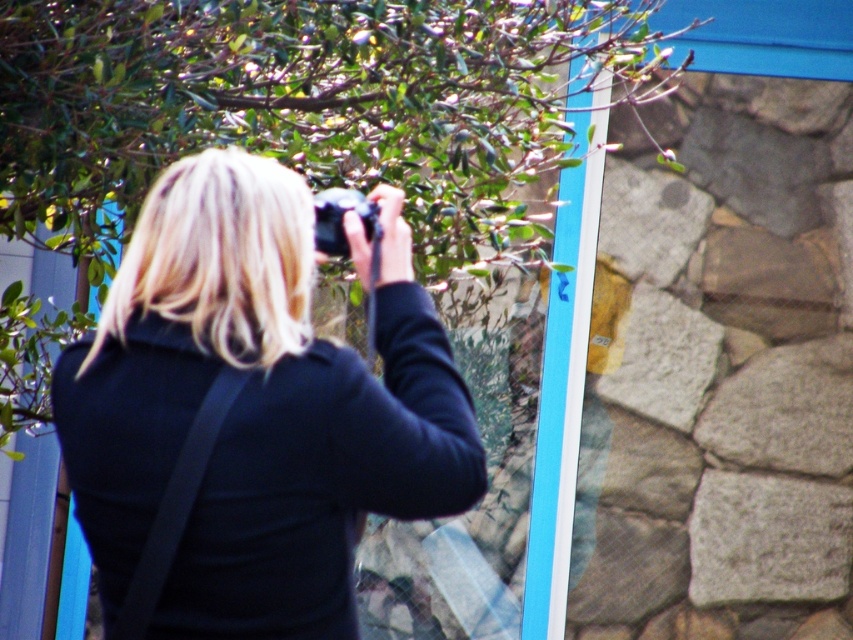
Question: Does black matte camera at upper center appear under black plastic camera at center?

Choices:
 (A) yes
 (B) no

Answer: (A)

Question: Considering the relative positions of black matte camera at upper center and black plastic camera at center in the image provided, where is black matte camera at upper center located with respect to black plastic camera at center?

Choices:
 (A) below
 (B) above

Answer: (A)

Question: Which point appears closest to the camera in this image?

Choices:
 (A) (328, 204)
 (B) (212, 227)

Answer: (B)

Question: Is black matte camera at upper center to the left of black plastic camera at center from the viewer's perspective?

Choices:
 (A) yes
 (B) no

Answer: (A)

Question: Which of the following is the closest to the observer?

Choices:
 (A) black plastic camera at center
 (B) black matte camera at upper center

Answer: (B)